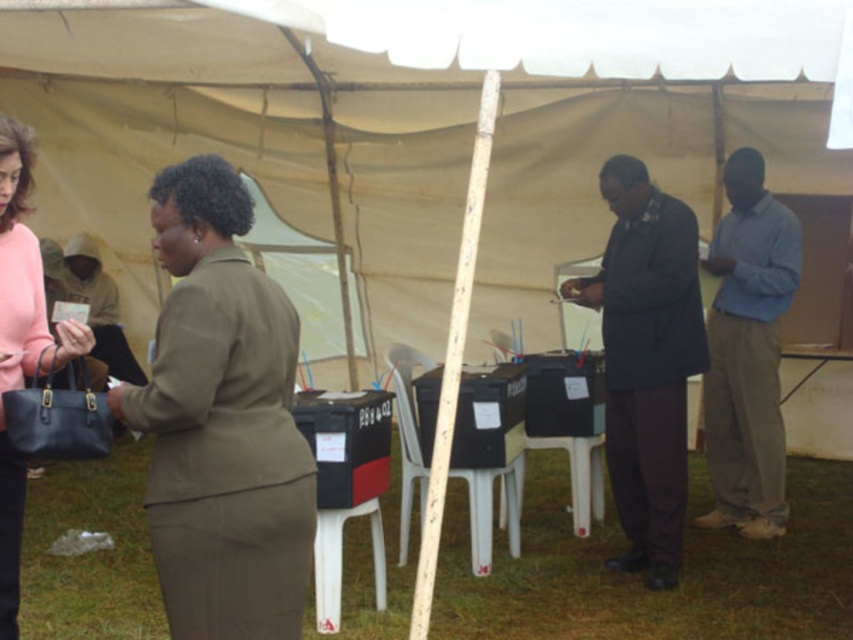
You are a photographer at the event and need to position yourself so that both the matte khaki suit at center and the pink fabric purse at left are visible in your frame. Based on their positions, which object should you place closer to the left edge of your camera view?

The pink fabric purse at left should be placed closer to the left edge of your camera view since it is positioned to the left of the matte khaki suit at center.

You are a photographer positioned at the back of the tent. You need to take a photo of both the dark brown suit at center and the blue cotton shirt at right. Which person should you ask to stand on a stool so that both can be seen clearly in the photo?

The dark brown suit at center is shorter than the blue cotton shirt at right, so you should ask the dark brown suit at center to stand on a stool to ensure both are visible in the photo.